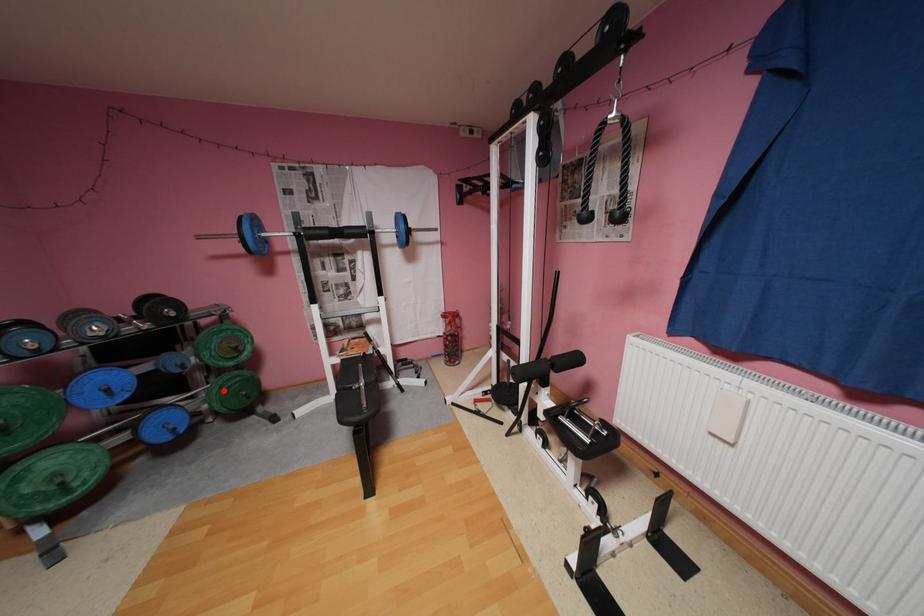
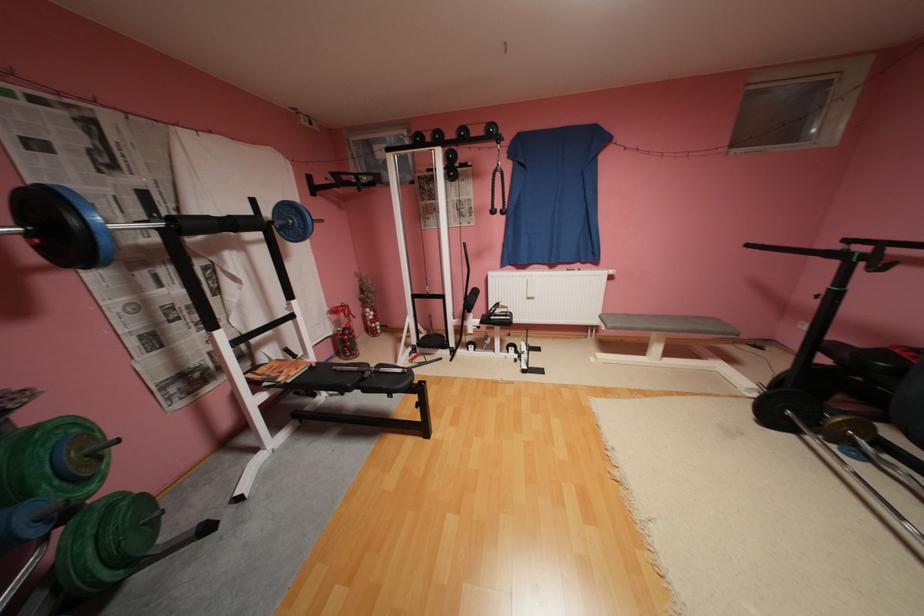
Find the pixel in the second image that matches the highlighted location in the first image.

(100, 551)